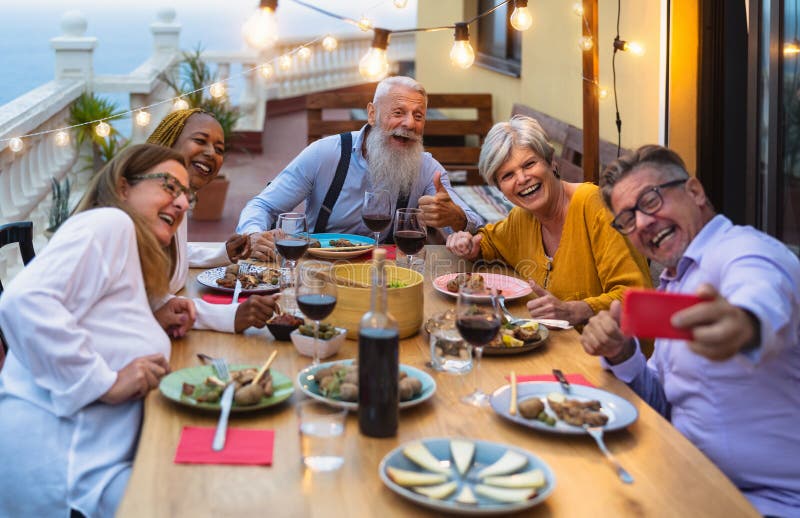
Identify the location of glasses of wine. (488, 319), (412, 234), (374, 211), (294, 236), (312, 297).